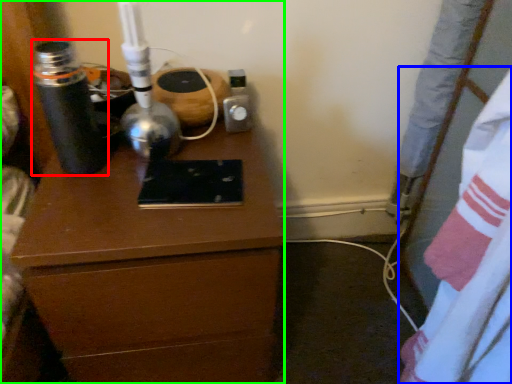
Question: Considering the real-world distances, which object is farthest from bottle (highlighted by a red box)? sheet (highlighted by a blue box) or chest of drawers (highlighted by a green box)?

Choices:
 (A) sheet
 (B) chest of drawers

Answer: (A)